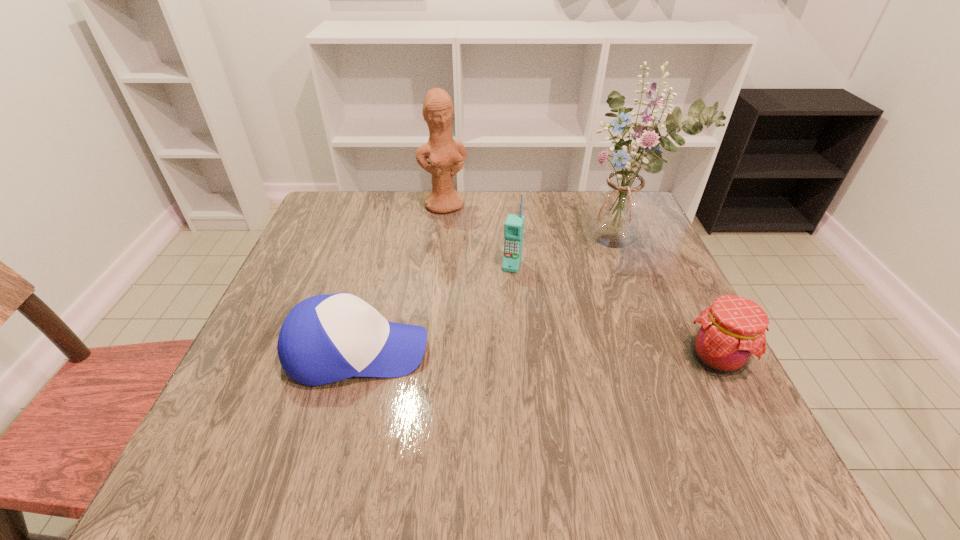
Where is `object that is positioned at the left edge`? object that is positioned at the left edge is located at coordinates (x=327, y=338).

The width and height of the screenshot is (960, 540). I want to click on jam located at the right edge, so click(x=730, y=333).

What are the coordinates of `bouquet present at the right edge` in the screenshot? It's located at (619, 208).

Identify the location of object that is at the near left corner. (327, 338).

Image resolution: width=960 pixels, height=540 pixels. I want to click on object that is at the far right corner, so click(x=619, y=208).

Locate an element on the screen. The height and width of the screenshot is (540, 960). vacant area at the far edge is located at coordinates (484, 233).

You are a GUI agent. You are given a task and a screenshot of the screen. Output one action in this format:
    pyautogui.click(x=<x>, y=<y>)
    Task: Click on the vacant space at the near edge
    
    Given the screenshot: What is the action you would take?
    pyautogui.click(x=431, y=402)

At what (x,y) coordinates should I click in order to perform the action: click on free location at the left edge of the desktop. Please return your answer as a coordinate pair (x, y). The image size is (960, 540). Looking at the image, I should click on (357, 258).

You are a GUI agent. You are given a task and a screenshot of the screen. Output one action in this format:
    pyautogui.click(x=<x>, y=<y>)
    Task: Click on the vacant space at the right edge of the desktop
    
    Given the screenshot: What is the action you would take?
    pyautogui.click(x=629, y=290)

In the image, there is a desktop. In order to click on vacant area at the far left corner in this screenshot , I will do `click(352, 202)`.